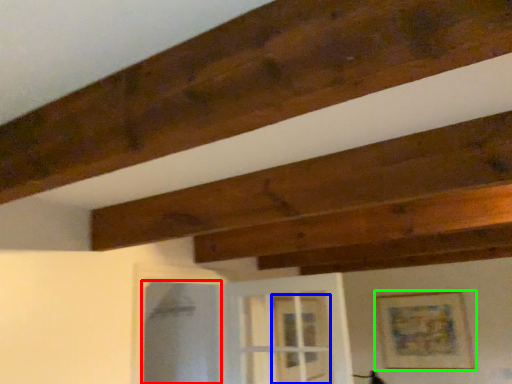
Question: Estimate the real-world distances between objects in this image. Which object is closer to screen door (highlighted by a red box), glass door (highlighted by a blue box) or picture frame (highlighted by a green box)?

Choices:
 (A) glass door
 (B) picture frame

Answer: (A)